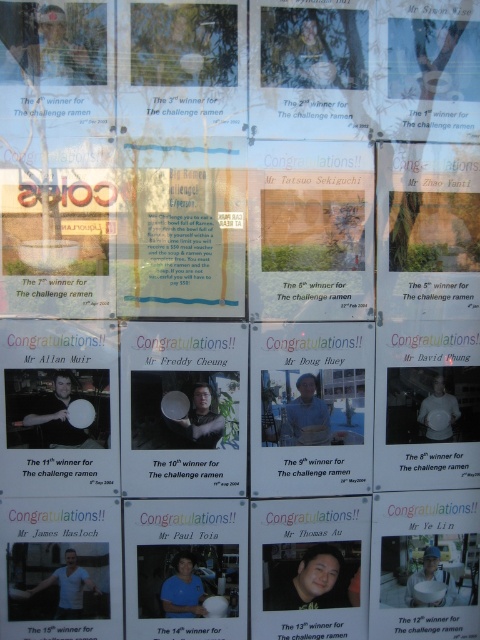
Between matte black laptop at upper center and matte white shirt at center right, which one is positioned higher?

matte black laptop at upper center

Is matte black laptop at upper center taller than matte white shirt at center right?

Yes, matte black laptop at upper center is taller than matte white shirt at center right.

Locate an element on the screen. matte black laptop at upper center is located at coordinates (308, 58).

Can you confirm if matte black frisbee at left is positioned to the right of matte white bowl at center?

Incorrect, matte black frisbee at left is not on the right side of matte white bowl at center.

I want to click on matte black frisbee at left, so click(x=58, y=417).

Does matte black shirt at center lie behind blue denim shirt at center?

Yes, it is.

Is matte black shirt at center shorter than blue denim shirt at center?

Correct, matte black shirt at center is not as tall as blue denim shirt at center.

Describe the element at coordinates (313, 582) in the screenshot. I see `matte black shirt at center` at that location.

I want to click on matte black shirt at center, so click(x=313, y=582).